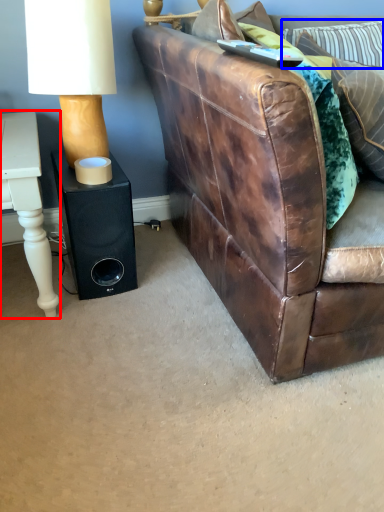
Question: Which of the following is the farthest to the observer, table (highlighted by a red box) or pillow (highlighted by a blue box)?

Choices:
 (A) table
 (B) pillow

Answer: (B)